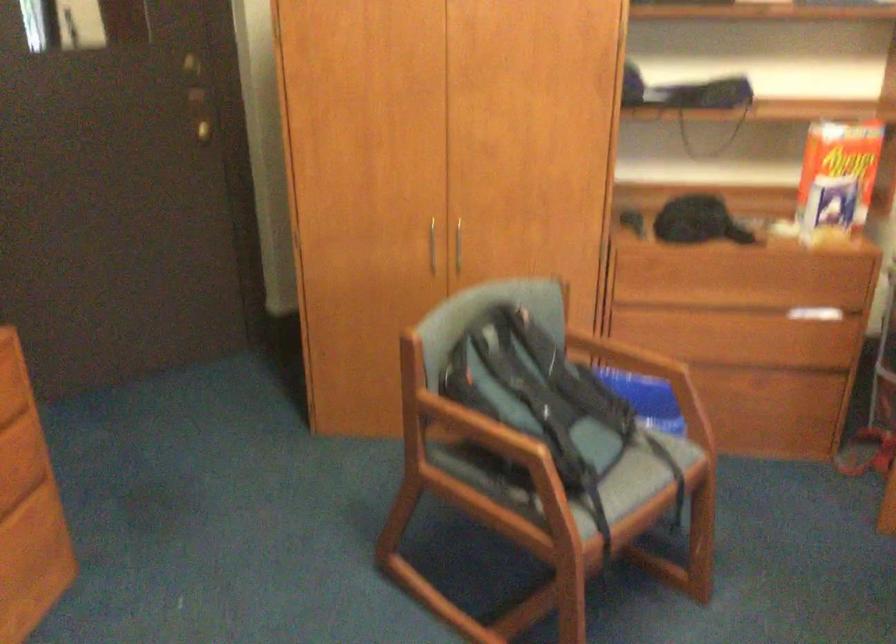
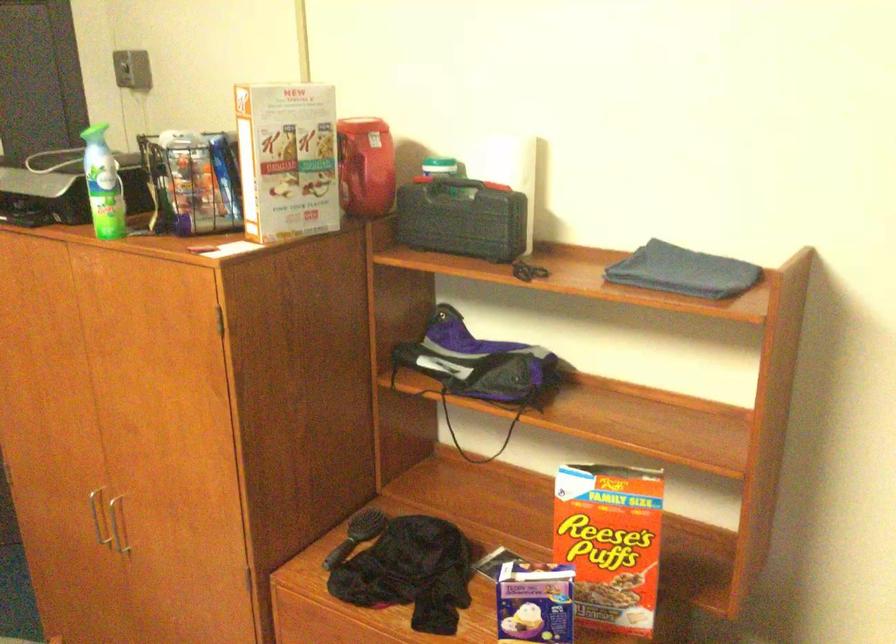
Which direction would the cameraman need to move to produce the second image?

The movement direction of the cameraman is right, forward.